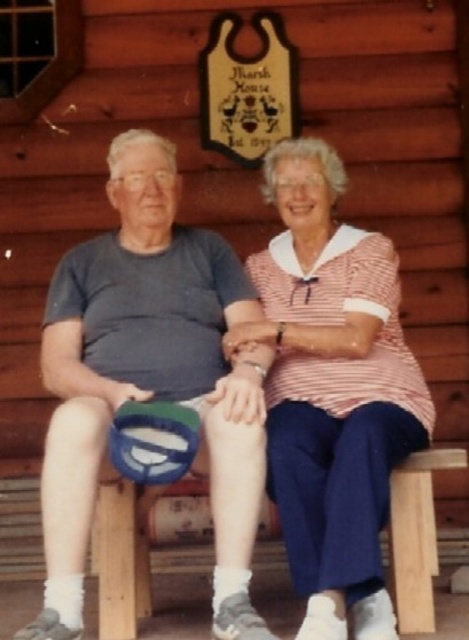
The height and width of the screenshot is (640, 469). What do you see at coordinates (149, 378) in the screenshot?
I see `matte gray t-shirt at center` at bounding box center [149, 378].

Does matte gray t-shirt at center have a smaller size compared to pink striped shirt at center?

Correct, matte gray t-shirt at center occupies less space than pink striped shirt at center.

Is point (80, 545) more distant than point (286, 541)?

That is False.

The width and height of the screenshot is (469, 640). Find the location of `matte gray t-shirt at center`. matte gray t-shirt at center is located at coordinates (149, 378).